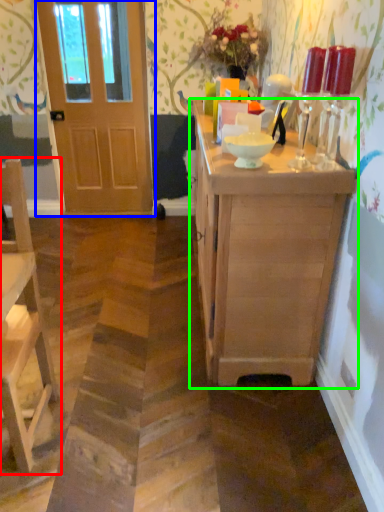
Question: Which object is the closest to the chair (highlighted by a red box)? Choose among these: door (highlighted by a blue box) or cabinetry (highlighted by a green box).

Choices:
 (A) door
 (B) cabinetry

Answer: (B)